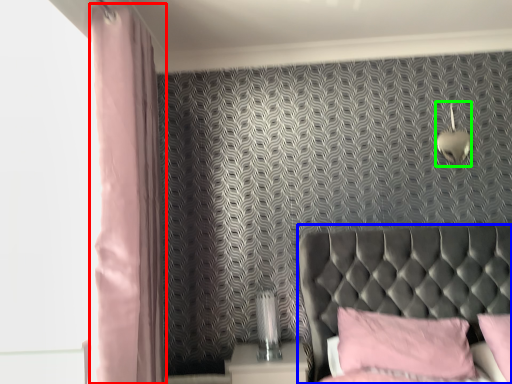
Question: Which object is positioned farthest from curtain (highlighted by a red box)? Select from furniture (highlighted by a blue box) and light fixture (highlighted by a green box).

Choices:
 (A) furniture
 (B) light fixture

Answer: (B)